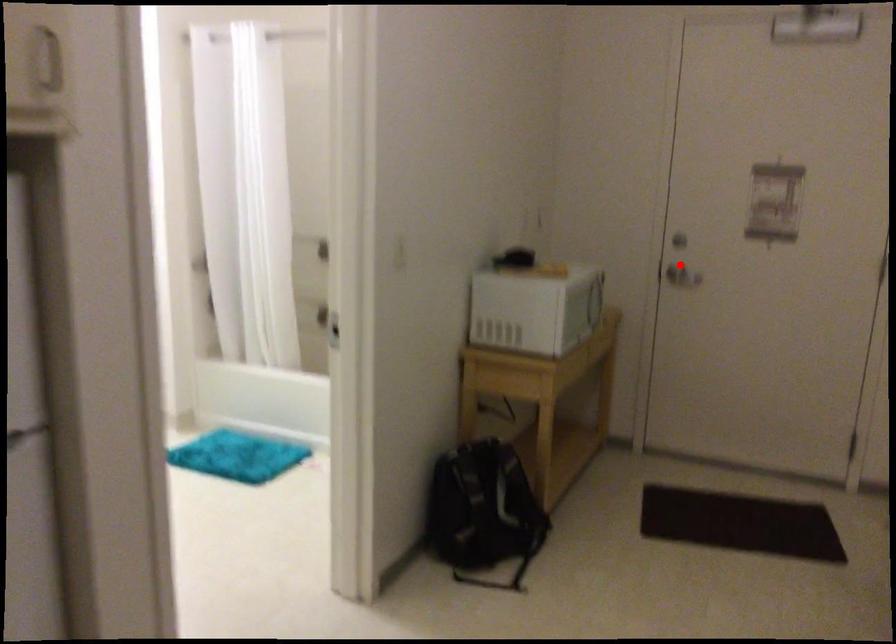
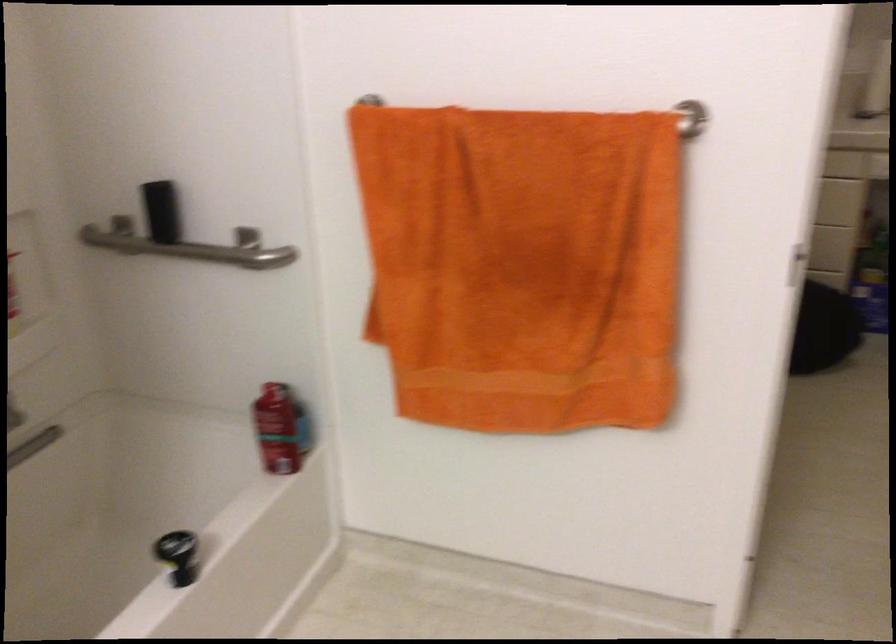
Question: I am providing you with two images of the same scene from different viewpoints. A red point is marked on the first image. Can you still see the location of the red point in image 2?

Choices:
 (A) Yes
 (B) No

Answer: (B)